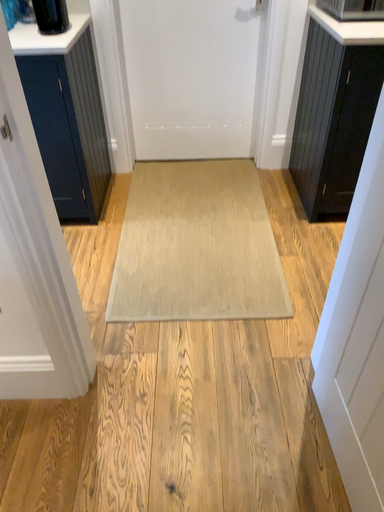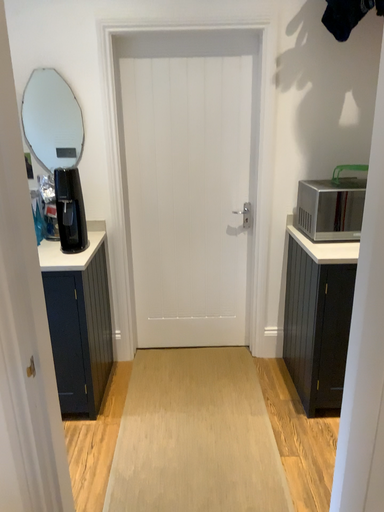
Question: How did the camera likely rotate when shooting the video?

Choices:
 (A) rotated upward
 (B) rotated downward

Answer: (A)